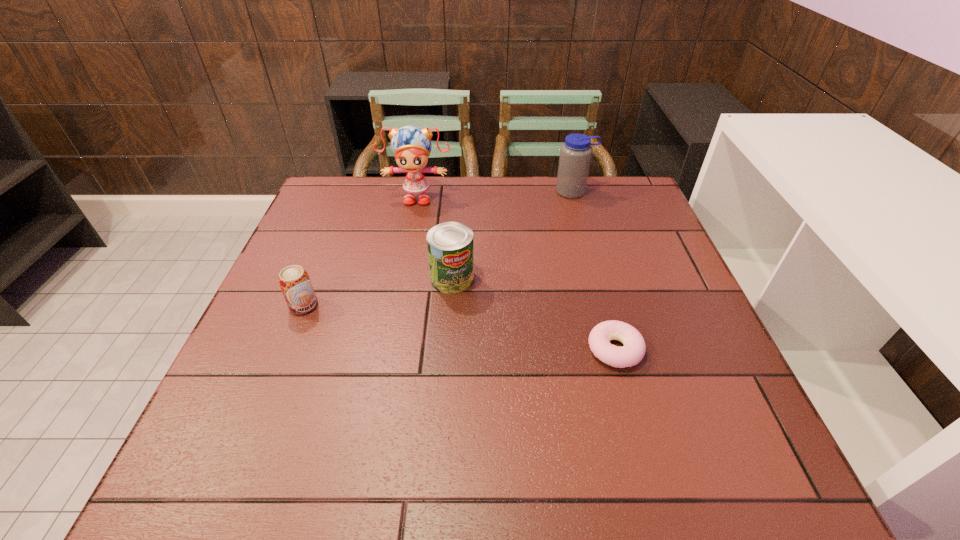
Identify the location of vacant space that satisfies the following two spatial constraints: 1. on the face of the can; 2. on the right side of the doll. (401, 278).